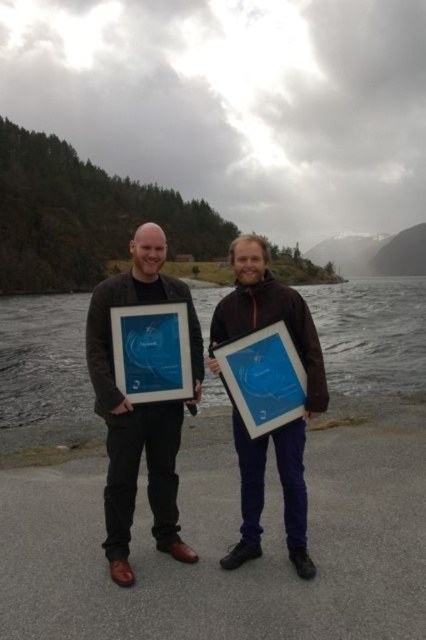
You are a photographer trying to capture a photo of both the blue glossy picture frame at center and the matte plastic picture frame at center. The camera you are using has a maximum focus range of 4 feet. Can you fit both frames into the photo without moving the camera?

The blue glossy picture frame at center and matte plastic picture frame at center are 4.19 feet apart from each other. Since the distance between them exceeds the camera maximum focus range of 4 feet, you cannot fit both frames into the photo without moving the camera.

You are an event photographer who needs to capture a wide shot of both the blue glass water at center and the matte black jacket at left without cropping either. Based on the scene, which object should you position closer to the camera to ensure both fit in the frame?

Since the blue glass water at center is wider than the matte black jacket at left, you should position the blue glass water at center closer to the camera to ensure both fit in the frame.